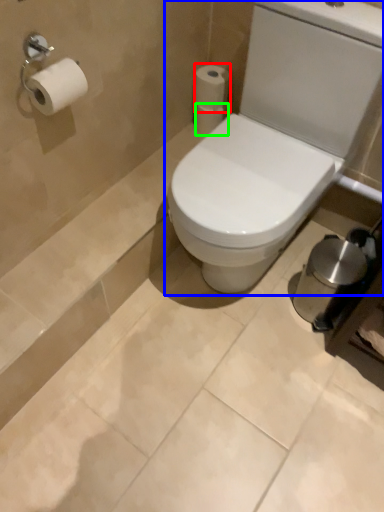
Question: Which is farther away from toilet paper (highlighted by a red box)? toilet (highlighted by a blue box) or toilet paper (highlighted by a green box)?

Choices:
 (A) toilet
 (B) toilet paper

Answer: (A)